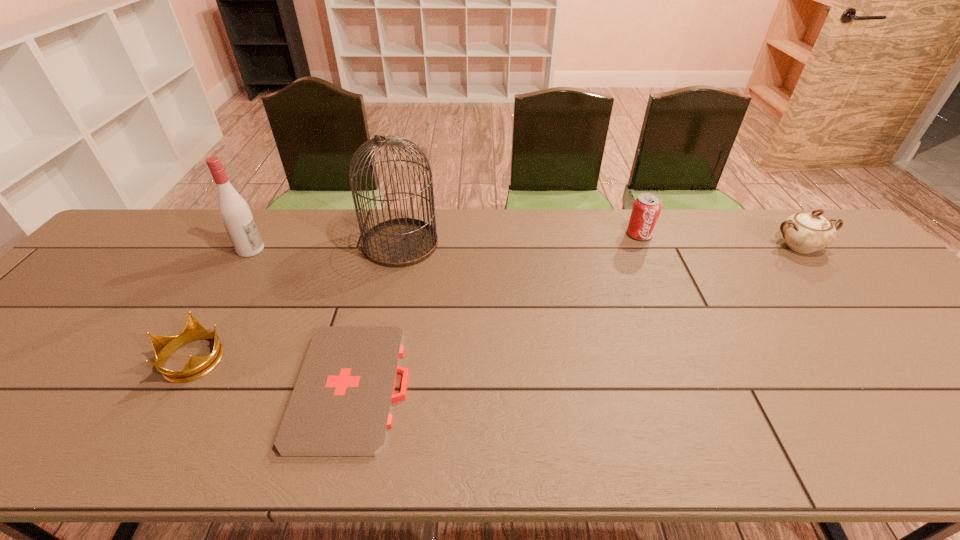
Where is `birdcage`? The width and height of the screenshot is (960, 540). birdcage is located at coordinates (401, 242).

Where is `the second tallest object`? Image resolution: width=960 pixels, height=540 pixels. the second tallest object is located at coordinates (234, 211).

Locate an element on the screen. This screenshot has width=960, height=540. the second object from right to left is located at coordinates (646, 209).

Find the location of a particular element. The width and height of the screenshot is (960, 540). the rightmost object is located at coordinates (805, 232).

Image resolution: width=960 pixels, height=540 pixels. What are the coordinates of `the second shortest object` in the screenshot? It's located at (197, 367).

Where is `the shortest object`? the shortest object is located at coordinates (341, 404).

At what (x,y) coordinates should I click in order to perform the action: click on free space located on the left of the tallest object. Please return your answer as a coordinate pair (x, y). This screenshot has width=960, height=540. Looking at the image, I should click on (231, 244).

This screenshot has width=960, height=540. I want to click on free spot located on the label of the fifth shortest object, so click(x=372, y=249).

Where is `blank area located 0.290m on the left of the soda can`? blank area located 0.290m on the left of the soda can is located at coordinates (533, 234).

Image resolution: width=960 pixels, height=540 pixels. In order to click on vacant space situated 0.300m on the left of the chinaware in this screenshot , I will do tap(670, 246).